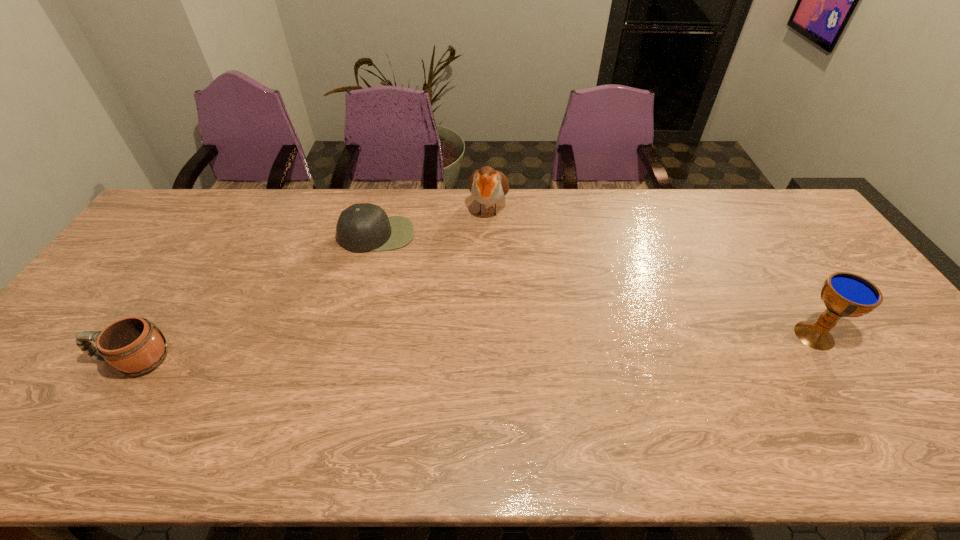
Where is `vacant space located 0.120m on the brim of the cap`? This screenshot has width=960, height=540. vacant space located 0.120m on the brim of the cap is located at coordinates (382, 280).

The width and height of the screenshot is (960, 540). I want to click on vacant space positioned 0.240m on the brim of the cap, so click(384, 312).

Where is `bird positioned at the far edge`? bird positioned at the far edge is located at coordinates click(488, 186).

Where is `cap at the far edge`? The image size is (960, 540). cap at the far edge is located at coordinates (363, 227).

Image resolution: width=960 pixels, height=540 pixels. What are the coordinates of `object at the near edge` in the screenshot? It's located at (133, 346).

In order to click on object that is at the left edge in this screenshot , I will do [x=133, y=346].

Locate an element on the screen. Image resolution: width=960 pixels, height=540 pixels. object that is at the near left corner is located at coordinates (133, 346).

Identify the location of vacant space at the far edge. tap(731, 227).

In the image, there is a desktop. Identify the location of vacant area at the near edge. This screenshot has height=540, width=960. (844, 382).

Image resolution: width=960 pixels, height=540 pixels. In the image, there is a desktop. In order to click on blank space at the left edge in this screenshot , I will do `click(47, 353)`.